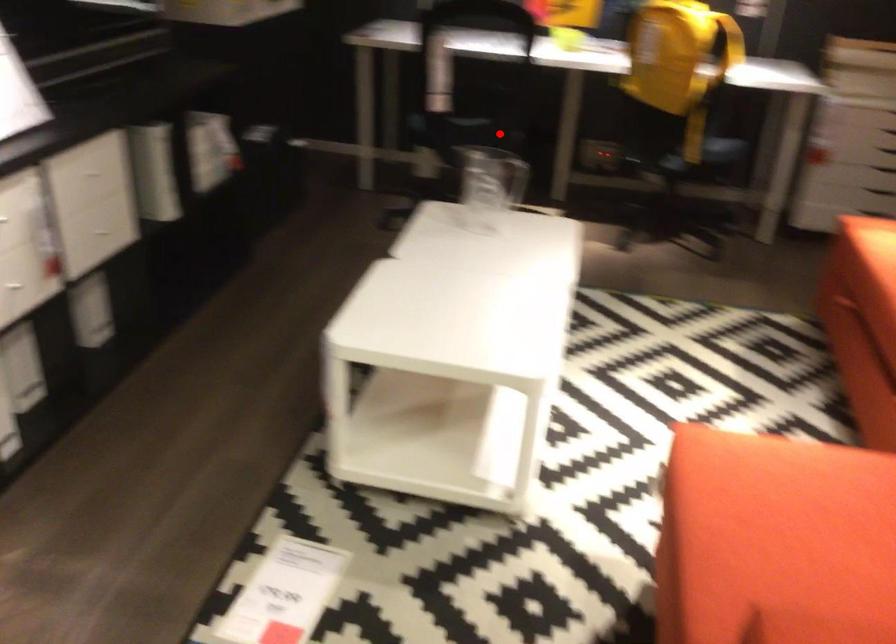
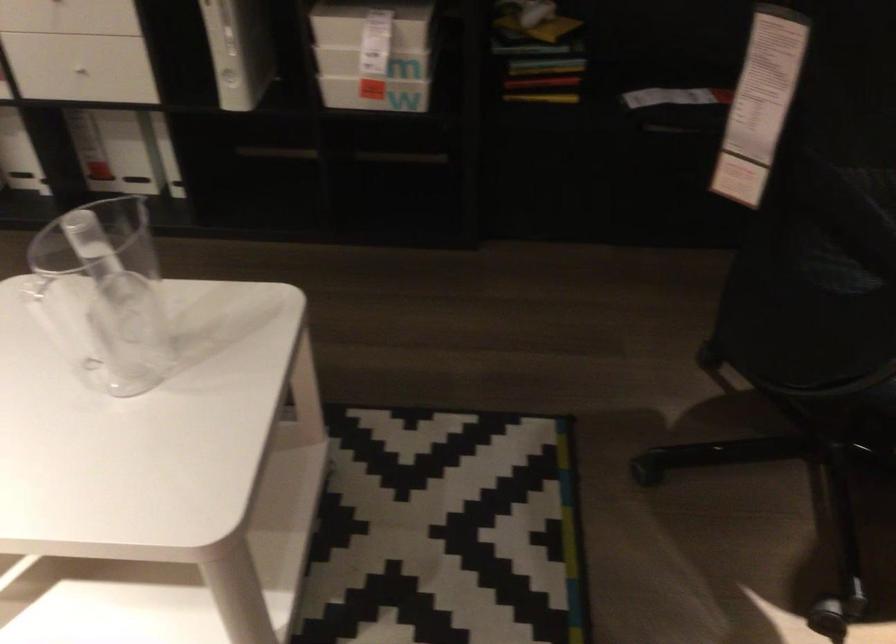
Question: I am providing you with two images of the same scene from different viewpoints. In image1, a red point is highlighted. Considering the same 3D point in image2, which of the following is correct?

Choices:
 (A) It is closer
 (B) It is farther

Answer: (A)